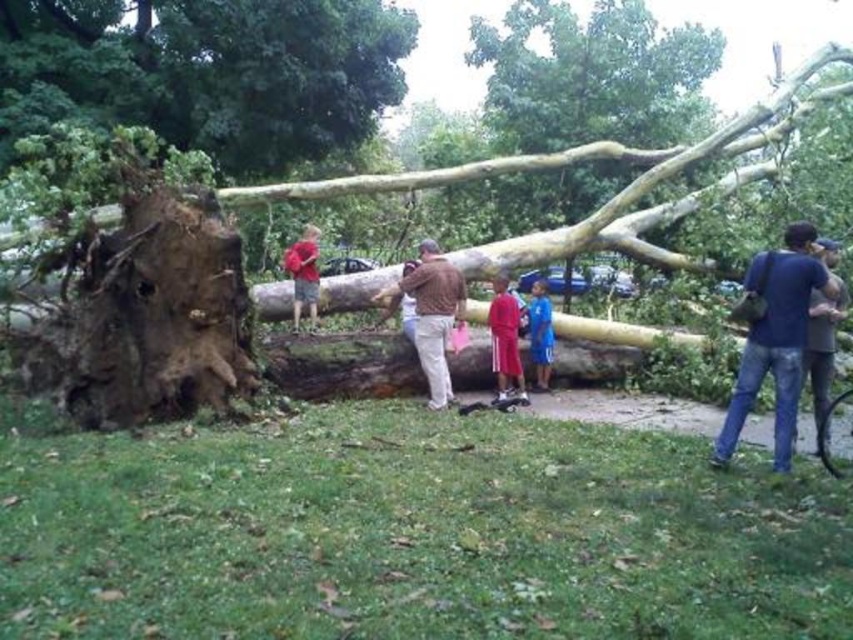
Question: Can you confirm if brown rough bark tree at center is wider than matte red shirt at center?

Choices:
 (A) no
 (B) yes

Answer: (B)

Question: Which of the following is the farthest from the observer?

Choices:
 (A) (503, 323)
 (B) (433, 356)
 (C) (766, 113)
 (D) (294, 285)

Answer: (C)

Question: Which is nearer to the matte red shirt at center?

Choices:
 (A) smooth brown log at center
 (B) dark blue jeans at lower right
 (C) blue cotton shirt at center
 (D) brown textured shirt at center

Answer: (D)

Question: Which of the following is the closest to the observer?

Choices:
 (A) (137, 109)
 (B) (579, 243)

Answer: (B)

Question: Is brown rough bark tree at center smaller than matte red shirt at center?

Choices:
 (A) yes
 (B) no

Answer: (B)

Question: Is brown textured shirt at center wider than matte red shorts at center?

Choices:
 (A) no
 (B) yes

Answer: (B)